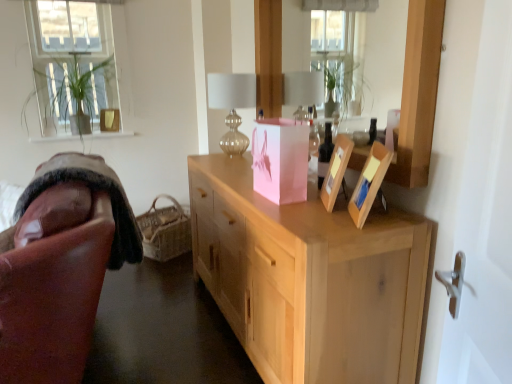
The image size is (512, 384). Identify the location of empty space that is ontop of clear glass window at upper left (from a real-world perspective). (69, 2).